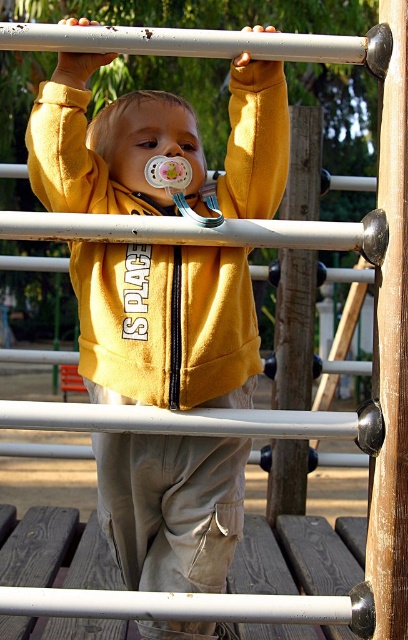
You are a photographer standing at a certain distance from the child wearing the yellow fleece sweatshirt at center. You want to take a closeup photo of the child without using a zoom lens. What should you do?

Move closer to the child wearing the yellow fleece sweatshirt at center until you are within 2.08 meters, which is the current distance between the yellow fleece sweatshirt at center and the camera, to capture a closeup without zoom.

You are a photographer trying to capture the child in the center of the image. The yellow fleece sweatshirt at center is represented by point (166, 324). Where should you position your camera to ensure the child is centered in the photo?

The yellow fleece sweatshirt at center is located at point (166, 324), so positioning the camera directly facing that coordinate will ensure the child is centered in the photo.